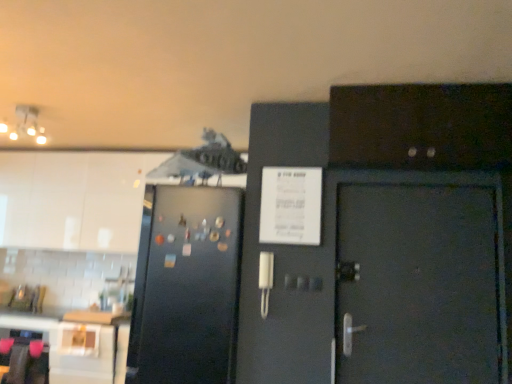
Image resolution: width=512 pixels, height=384 pixels. What do you see at coordinates (186, 286) in the screenshot? I see `black matte refrigerator at left` at bounding box center [186, 286].

Measure the distance between point (506, 145) and camera.

Point (506, 145) and camera are 7.93 feet apart from each other.

The image size is (512, 384). Identify the location of matte white ceiling light at upper left. (25, 124).

Based on their positions, is white glossy cabinet at upper left, marked as the 1th cabinetry in a left-to-right arrangement, located to the left or right of dark wood cabinet at upper right, placed as the 1th cabinetry when sorted from front to back?

From the image, it's evident that white glossy cabinet at upper left, marked as the 1th cabinetry in a left-to-right arrangement, is to the left of dark wood cabinet at upper right, placed as the 1th cabinetry when sorted from front to back.

Are white glossy cabinet at upper left, the second cabinetry positioned from the front, and dark wood cabinet at upper right, marked as the 1th cabinetry in a right-to-left arrangement, beside each other?

No, white glossy cabinet at upper left, the second cabinetry positioned from the front, is not in contact with dark wood cabinet at upper right, marked as the 1th cabinetry in a right-to-left arrangement.

From a real-world perspective, between white glossy cabinet at upper left, marked as the 1th cabinetry in a left-to-right arrangement, and dark wood cabinet at upper right, positioned as the second cabinetry in left-to-right order, who is vertically higher?

In real-world perspective, dark wood cabinet at upper right, positioned as the second cabinetry in left-to-right order, is above.

From their relative heights in the image, would you say white glossy cabinet at upper left, which is counted as the second cabinetry, starting from the right, is taller or shorter than dark wood cabinet at upper right, placed as the 1th cabinetry when sorted from front to back?

Considering their sizes, white glossy cabinet at upper left, which is counted as the second cabinetry, starting from the right, has more height than dark wood cabinet at upper right, placed as the 1th cabinetry when sorted from front to back.

Between dark wood cabinet at upper right, marked as the 1th cabinetry in a right-to-left arrangement, and black matte refrigerator at left, which one is positioned in front?

dark wood cabinet at upper right, marked as the 1th cabinetry in a right-to-left arrangement, is closer to the camera.

From the image's perspective, is dark wood cabinet at upper right, arranged as the second cabinetry when viewed from the back, located above or below black matte refrigerator at left?

From the image's perspective, dark wood cabinet at upper right, arranged as the second cabinetry when viewed from the back, appears above black matte refrigerator at left.

From a real-world perspective, is dark wood cabinet at upper right, arranged as the second cabinetry when viewed from the back, below black matte refrigerator at left?

No, from a real-world perspective, dark wood cabinet at upper right, arranged as the second cabinetry when viewed from the back, is not beneath black matte refrigerator at left.

Considering the relative sizes of dark wood cabinet at upper right, positioned as the second cabinetry in left-to-right order, and black matte refrigerator at left in the image provided, is dark wood cabinet at upper right, positioned as the second cabinetry in left-to-right order, bigger than black matte refrigerator at left?

No.

Where is `table to the left of black matte refrigerator at left`? table to the left of black matte refrigerator at left is located at coordinates (75, 351).

Do you think black matte refrigerator at left is within white glossy table at lower left, or outside of it?

black matte refrigerator at left is not enclosed by white glossy table at lower left.

From the image's perspective, which object appears higher, black matte refrigerator at left or white glossy table at lower left?

black matte refrigerator at left.

From the picture: Measure the distance between white glossy table at lower left and white glossy cabinet at upper left, which is counted as the second cabinetry, starting from the right.

white glossy table at lower left and white glossy cabinet at upper left, which is counted as the second cabinetry, starting from the right, are 3.63 feet apart from each other.

The width and height of the screenshot is (512, 384). I want to click on table below the white glossy cabinet at upper left, which is counted as the second cabinetry, starting from the right (from a real-world perspective), so click(x=75, y=351).

In the scene shown: Who is smaller, white glossy table at lower left or white glossy cabinet at upper left, which is counted as the second cabinetry, starting from the right?

white glossy table at lower left is smaller.

Which object is positioned more to the left, dark wood cabinet at upper right, marked as the 1th cabinetry in a right-to-left arrangement, or white glossy cabinet at upper left, which is counted as the second cabinetry, starting from the right?

Positioned to the left is white glossy cabinet at upper left, which is counted as the second cabinetry, starting from the right.

Can you confirm if dark wood cabinet at upper right, positioned as the second cabinetry in left-to-right order, is wider than white glossy cabinet at upper left, marked as the 1th cabinetry in a left-to-right arrangement?

In fact, dark wood cabinet at upper right, positioned as the second cabinetry in left-to-right order, might be narrower than white glossy cabinet at upper left, marked as the 1th cabinetry in a left-to-right arrangement.

Is dark wood cabinet at upper right, marked as the 1th cabinetry in a right-to-left arrangement, surrounding white glossy cabinet at upper left, which is counted as the second cabinetry, starting from the right?

No, white glossy cabinet at upper left, which is counted as the second cabinetry, starting from the right, is not a part of dark wood cabinet at upper right, marked as the 1th cabinetry in a right-to-left arrangement.

Is matte white ceiling light at upper left aimed at dark wood cabinet at upper right, placed as the 1th cabinetry when sorted from front to back?

No, matte white ceiling light at upper left is not facing towards dark wood cabinet at upper right, placed as the 1th cabinetry when sorted from front to back.

From a real-world perspective, count 1st cabinetrys downward from the matte white ceiling light at upper left and point to it. Please provide its 2D coordinates.

[(422, 126)]

From the image's perspective, would you say matte white ceiling light at upper left is positioned over dark wood cabinet at upper right, positioned as the second cabinetry in left-to-right order?

Indeed, from the image's perspective, matte white ceiling light at upper left is shown above dark wood cabinet at upper right, positioned as the second cabinetry in left-to-right order.

Which of these two, white glossy table at lower left or black matte refrigerator at left, is thinner?

white glossy table at lower left is thinner.

Looking at this image, is black matte refrigerator at left located within white glossy table at lower left?

No.

Which is more to the right, white glossy table at lower left or black matte refrigerator at left?

From the viewer's perspective, black matte refrigerator at left appears more on the right side.

In the image, there is a black matte refrigerator at left. Where is `table below it (from a real-world perspective)`? The width and height of the screenshot is (512, 384). table below it (from a real-world perspective) is located at coordinates click(75, 351).

I want to click on cabinetry behind the dark wood cabinet at upper right, positioned as the second cabinetry in left-to-right order, so 73,199.

Identify the location of cabinetry on the right side of black matte refrigerator at left. The width and height of the screenshot is (512, 384). (422, 126).

Estimate the real-world distances between objects in this image. Which object is closer to matte white ceiling light at upper left, white glossy cabinet at upper left, marked as the 1th cabinetry in a back-to-front arrangement, or white glossy table at lower left?

white glossy cabinet at upper left, marked as the 1th cabinetry in a back-to-front arrangement, is closer to matte white ceiling light at upper left.

From the image, which object appears to be nearer to white glossy cabinet at upper left, marked as the 1th cabinetry in a left-to-right arrangement, white glossy table at lower left or black matte refrigerator at left?

The object closer to white glossy cabinet at upper left, marked as the 1th cabinetry in a left-to-right arrangement, is white glossy table at lower left.

From the image, which object appears to be nearer to black matte refrigerator at left, matte white ceiling light at upper left or dark wood cabinet at upper right, marked as the 1th cabinetry in a right-to-left arrangement?

The object closer to black matte refrigerator at left is dark wood cabinet at upper right, marked as the 1th cabinetry in a right-to-left arrangement.

In the scene shown: Looking at the image, which one is located further to black matte refrigerator at left, white glossy cabinet at upper left, marked as the 1th cabinetry in a left-to-right arrangement, or matte white ceiling light at upper left?

matte white ceiling light at upper left is positioned further to the anchor black matte refrigerator at left.

When comparing their distances from white glossy cabinet at upper left, marked as the 1th cabinetry in a left-to-right arrangement, does matte white ceiling light at upper left or black matte refrigerator at left seem further?

black matte refrigerator at left lies further to white glossy cabinet at upper left, marked as the 1th cabinetry in a left-to-right arrangement, than the other object.

Looking at the image, which one is located closer to white glossy table at lower left, white glossy cabinet at upper left, marked as the 1th cabinetry in a back-to-front arrangement, or black matte refrigerator at left?

white glossy cabinet at upper left, marked as the 1th cabinetry in a back-to-front arrangement, is closer to white glossy table at lower left.

Based on their spatial positions, is matte white ceiling light at upper left or white glossy cabinet at upper left, marked as the 1th cabinetry in a left-to-right arrangement, closer to dark wood cabinet at upper right, positioned as the second cabinetry in left-to-right order?

The object closer to dark wood cabinet at upper right, positioned as the second cabinetry in left-to-right order, is matte white ceiling light at upper left.

Which object lies further to the anchor point dark wood cabinet at upper right, placed as the 1th cabinetry when sorted from front to back, white glossy cabinet at upper left, marked as the 1th cabinetry in a left-to-right arrangement, or matte white ceiling light at upper left?

Among the two, white glossy cabinet at upper left, marked as the 1th cabinetry in a left-to-right arrangement, is located further to dark wood cabinet at upper right, placed as the 1th cabinetry when sorted from front to back.

You are a GUI agent. You are given a task and a screenshot of the screen. Output one action in this format:
    pyautogui.click(x=<x>, y=<y>)
    Task: Click on the refrigerator between white glossy cabinet at upper left, marked as the 1th cabinetry in a left-to-right arrangement, and dark wood cabinet at upper right, marked as the 1th cabinetry in a right-to-left arrangement
    Image resolution: width=512 pixels, height=384 pixels.
    Given the screenshot: What is the action you would take?
    pyautogui.click(x=186, y=286)

Identify the location of cabinetry situated between white glossy table at lower left and dark wood cabinet at upper right, marked as the 1th cabinetry in a right-to-left arrangement, from left to right. This screenshot has width=512, height=384. (73, 199).

The height and width of the screenshot is (384, 512). In order to click on lamp between white glossy table at lower left and dark wood cabinet at upper right, marked as the 1th cabinetry in a right-to-left arrangement, from left to right in this screenshot , I will do `click(25, 124)`.

The image size is (512, 384). Find the location of `refrigerator between matte white ceiling light at upper left and dark wood cabinet at upper right, arranged as the second cabinetry when viewed from the back`. refrigerator between matte white ceiling light at upper left and dark wood cabinet at upper right, arranged as the second cabinetry when viewed from the back is located at coordinates (186, 286).